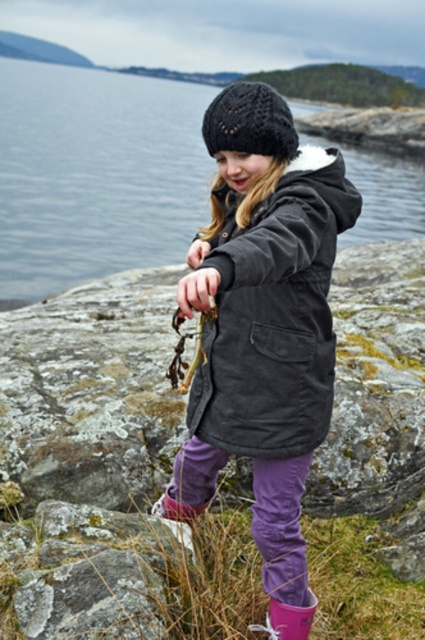
Question: Which object appears closest to the camera in this image?

Choices:
 (A) dark gray corduroy jacket at center
 (B) gray rough rock at lower left
 (C) purple rubber boot at lower center

Answer: (A)

Question: Is the position of matte black coat at center more distant than that of transparent water at center?

Choices:
 (A) yes
 (B) no

Answer: (B)

Question: Which object is closer to the camera taking this photo?

Choices:
 (A) matte black coat at center
 (B) gray rough rock at lower left
 (C) dark gray corduroy jacket at center
 (D) purple rubber boot at lower center

Answer: (A)

Question: Estimate the real-world distances between objects in this image. Which object is closer to the purple rubber boot at lower center?

Choices:
 (A) dark gray corduroy jacket at center
 (B) transparent water at center
 (C) gray rough rock at lower left
 (D) black knitted hat at center

Answer: (C)

Question: Can you confirm if black knitted hat at center is thinner than purple rubber boot at lower center?

Choices:
 (A) yes
 (B) no

Answer: (B)

Question: Is matte black coat at center to the left of purple rubber boot at lower center from the viewer's perspective?

Choices:
 (A) no
 (B) yes

Answer: (B)